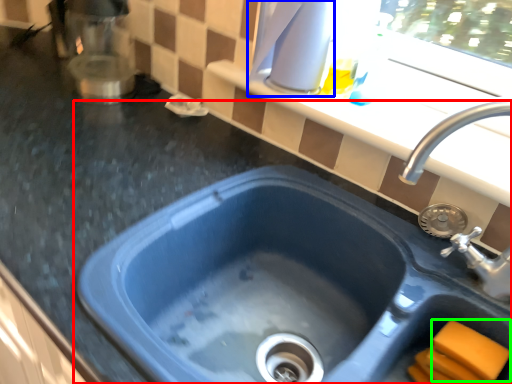
Question: Which object is the closest to the sink (highlighted by a red box)? Choose among these: appliance (highlighted by a blue box) or soap (highlighted by a green box).

Choices:
 (A) appliance
 (B) soap

Answer: (B)